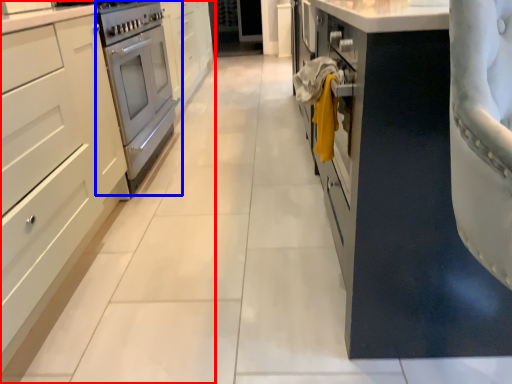
Question: Which point is further to the camera, cabinetry (highlighted by a red box) or home appliance (highlighted by a blue box)?

Choices:
 (A) cabinetry
 (B) home appliance

Answer: (B)